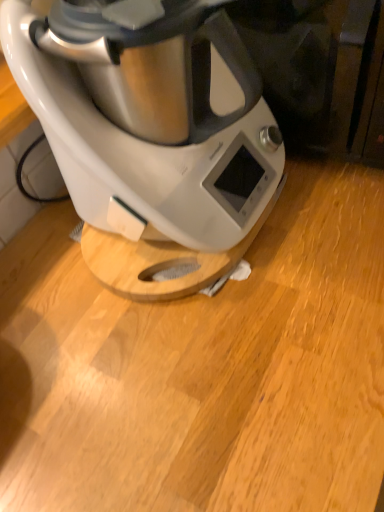
Identify the location of white matte mixer at center. The height and width of the screenshot is (512, 384). (150, 141).

Image resolution: width=384 pixels, height=512 pixels. What do you see at coordinates (150, 141) in the screenshot?
I see `white matte mixer at center` at bounding box center [150, 141].

Locate an element on the screen. white matte mixer at center is located at coordinates (150, 141).